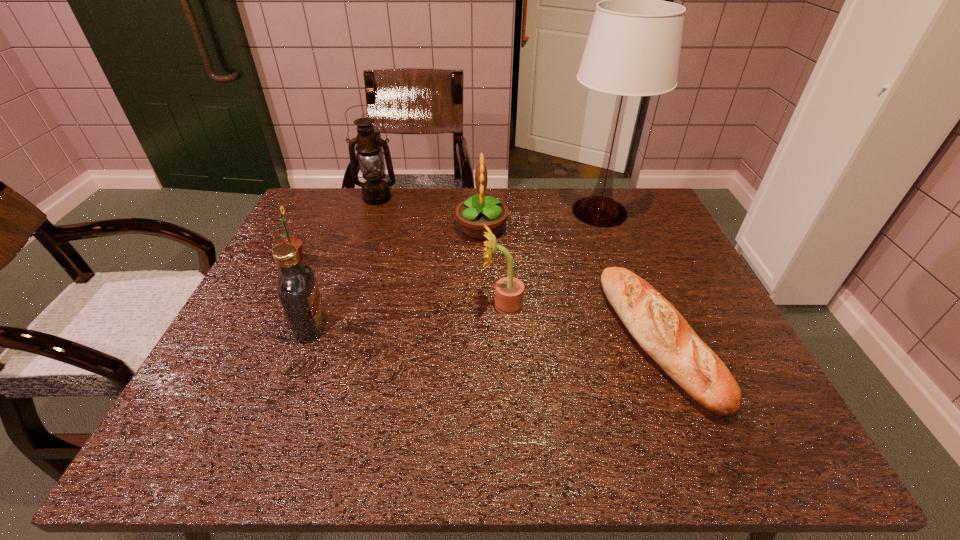
Where is `oil lamp that is at the far edge`? The width and height of the screenshot is (960, 540). oil lamp that is at the far edge is located at coordinates (375, 191).

At what (x,y) coordinates should I click in order to perform the action: click on sunflower present at the far edge. Please return your answer as a coordinate pair (x, y). This screenshot has width=960, height=540. Looking at the image, I should click on (471, 214).

You are a GUI agent. You are given a task and a screenshot of the screen. Output one action in this format:
    pyautogui.click(x=<x>, y=<y>)
    Task: Click on the object that is at the near edge
    
    Given the screenshot: What is the action you would take?
    pyautogui.click(x=662, y=332)

This screenshot has height=540, width=960. In order to click on oil lamp present at the left edge in this screenshot , I will do `click(375, 191)`.

This screenshot has width=960, height=540. What are the coordinates of `vodka that is at the left edge` in the screenshot? It's located at (298, 292).

I want to click on sunflower located in the left edge section of the desktop, so click(x=296, y=242).

Locate an element on the screen. This screenshot has height=540, width=960. table lamp at the right edge is located at coordinates (633, 49).

The height and width of the screenshot is (540, 960). Identify the location of baguet that is at the right edge. (662, 332).

This screenshot has width=960, height=540. What are the coordinates of `object present at the far left corner` in the screenshot? It's located at (375, 191).

Image resolution: width=960 pixels, height=540 pixels. Find the location of `object located at the far right corner`. object located at the far right corner is located at coordinates (633, 49).